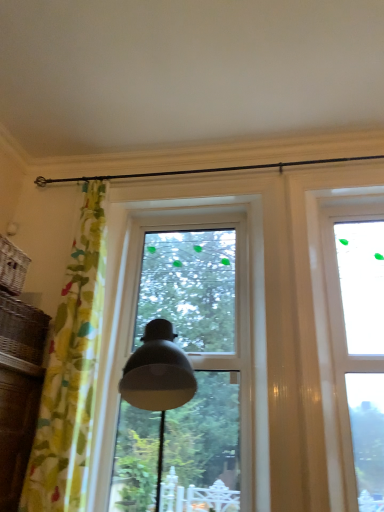
Question: In the image, is woven brown basket at left, which ranks as the 2th basket in top-to-bottom order, on the left side or the right side of transparent glass window at upper right, which is counted as the 1th window, starting from the right?

Choices:
 (A) right
 (B) left

Answer: (B)

Question: Relative to transparent glass window at upper right, which is counted as the 1th window, starting from the right, is woven brown basket at left, which ranks as the 2th basket in top-to-bottom order, in front or behind?

Choices:
 (A) front
 (B) behind

Answer: (A)

Question: Which of these objects is positioned farthest from the woven wicker basket at left, positioned as the second basket in bottom-to-top order?

Choices:
 (A) transparent glass window at center, marked as the first window in a left-to-right arrangement
 (B) yellow floral fabric curtain at left
 (C) transparent glass window at upper right, which is counted as the 1th window, starting from the right
 (D) woven brown basket at left, which ranks as the 2th basket in top-to-bottom order

Answer: (C)

Question: Which object is positioned farthest from the yellow floral fabric curtain at left?

Choices:
 (A) transparent glass window at upper right, the second window in the left-to-right sequence
 (B) woven brown basket at left, the 1th basket from the bottom
 (C) transparent glass window at center, arranged as the 2th window when viewed from the right
 (D) woven wicker basket at left, positioned as the second basket in bottom-to-top order

Answer: (A)